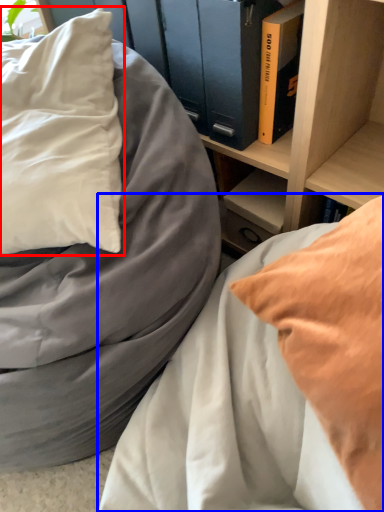
Question: Which point is further to the camera, pillow (highlighted by a red box) or bed (highlighted by a blue box)?

Choices:
 (A) pillow
 (B) bed

Answer: (A)